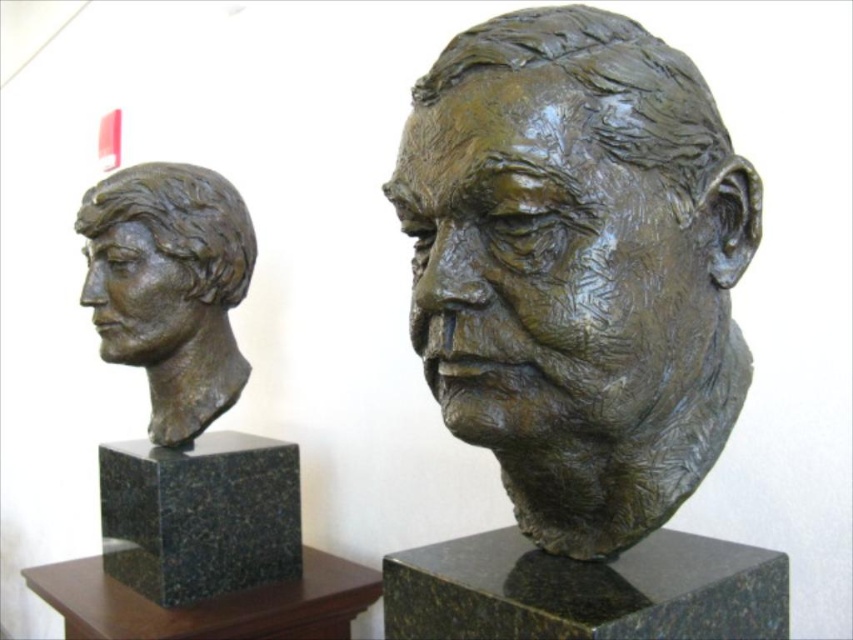
Does bronze sculpture at center have a greater width compared to matte bronze head at left?

A: Correct, the width of bronze sculpture at center exceeds that of matte bronze head at left.

Between bronze sculpture at center and matte bronze head at left, which one is positioned higher?

matte bronze head at left

The image size is (853, 640). I want to click on bronze sculpture at center, so [x=577, y=268].

Find the location of a particular element. bronze sculpture at center is located at coordinates (577, 268).

Which is in front, point (625, 80) or point (242, 442)?

Point (625, 80) is more forward.

Is point (564, 58) less distant than point (219, 388)?

Yes, it is in front of point (219, 388).

Which is in front, point (473, 417) or point (280, 445)?

Point (473, 417)

The image size is (853, 640). Find the location of `bronze sculpture at center`. bronze sculpture at center is located at coordinates [x=577, y=268].

Is point (134, 364) closer to viewer compared to point (236, 262)?

Yes, point (134, 364) is in front of point (236, 262).

Describe the element at coordinates (183, 387) in the screenshot. This screenshot has width=853, height=640. I see `bronze bust at left` at that location.

Identify the location of bronze bust at left. This screenshot has width=853, height=640. (183, 387).